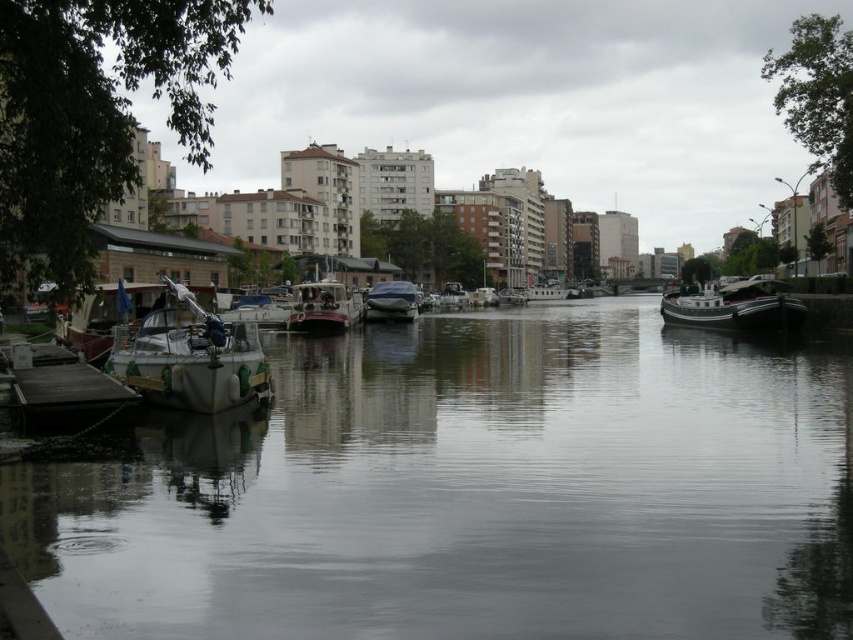
Is metallic red boat at center to the right of white matte sailboat at center from the viewer's perspective?

Yes, metallic red boat at center is to the right of white matte sailboat at center.

Between metallic red boat at center and white matte sailboat at center, which one is positioned lower?

Positioned lower is white matte sailboat at center.

I want to click on metallic red boat at center, so click(323, 307).

Looking at this image, between shiny silver boat at center and white matte boat at center, which one is positioned lower?

shiny silver boat at center

Does shiny silver boat at center lie in front of white matte boat at center?

Yes, it is.

The image size is (853, 640). What do you see at coordinates (390, 301) in the screenshot?
I see `shiny silver boat at center` at bounding box center [390, 301].

At what (x,y) coordinates should I click in order to perform the action: click on shiny silver boat at center. Please return your answer as a coordinate pair (x, y). The height and width of the screenshot is (640, 853). Looking at the image, I should click on (390, 301).

Is white glossy boat at right to the right of white matte boat at center from the viewer's perspective?

Yes, white glossy boat at right is to the right of white matte boat at center.

Is point (711, 308) positioned before point (538, 289)?

Yes, it is in front of point (538, 289).

Does point (711, 326) lie behind point (554, 298)?

No.

This screenshot has width=853, height=640. What are the coordinates of `white glossy boat at right` in the screenshot? It's located at (734, 307).